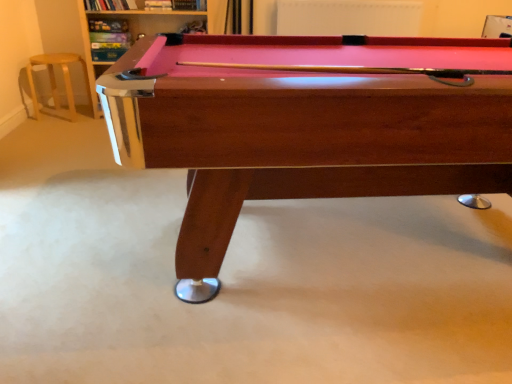
In order to click on free spot below wooden billiard table at center (from a real-world perspective) in this screenshot , I will do `click(372, 246)`.